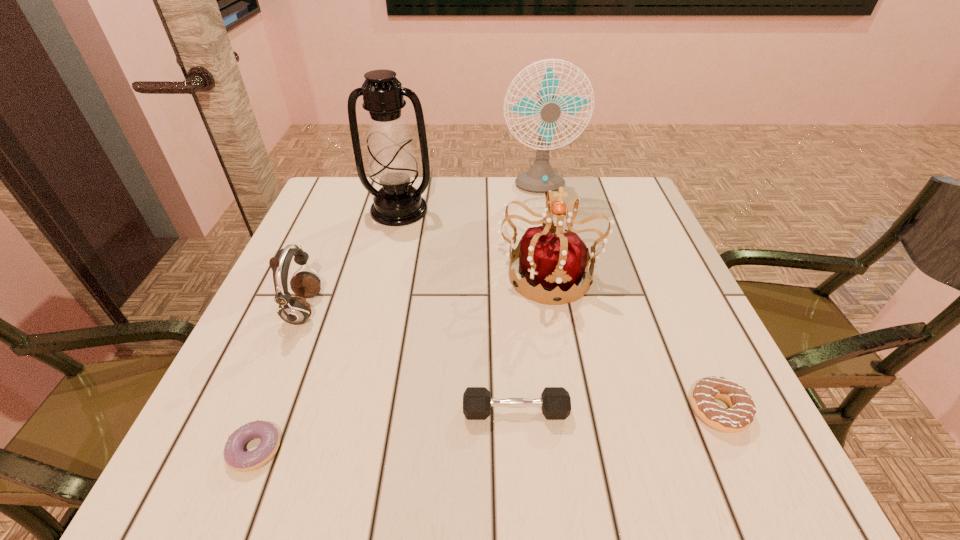
Identify the location of free space between the right doughnut and the fan. (628, 300).

Where is `the sixth closest object to the fifth object from right to left`? The width and height of the screenshot is (960, 540). the sixth closest object to the fifth object from right to left is located at coordinates (740, 416).

Locate which object is the second closest to the left doughnut. Please provide its 2D coordinates. Your answer should be formatted as a tuple, i.e. [(x, y)], where the tuple contains the x and y coordinates of a point satisfying the conditions above.

[(555, 402)]

Identify the location of free space that satisfies the following two spatial constraints: 1. on the ear pads of the fifth tallest object; 2. on the right side of the fourth tallest object. The height and width of the screenshot is (540, 960). (262, 411).

At what (x,y) coordinates should I click in order to perform the action: click on free region that satisfies the following two spatial constraints: 1. on the front-facing side of the taller doughnut; 2. on the left side of the tiara. Please return your answer as a coordinate pair (x, y). The height and width of the screenshot is (540, 960). Looking at the image, I should click on (572, 410).

In order to click on vacant space that satisfies the following two spatial constraints: 1. on the ear pads of the third shortest object; 2. on the left side of the fourth shortest object in this screenshot , I will do pyautogui.click(x=262, y=411).

In order to click on vacant space that satisfies the following two spatial constraints: 1. on the ear pads of the left doughnut; 2. on the right side of the fourth shortest object in this screenshot , I will do `click(246, 449)`.

Identify the location of blank space that satisfies the following two spatial constraints: 1. on the ear pads of the fourth shortest object; 2. on the left side of the rightmost object. (262, 410).